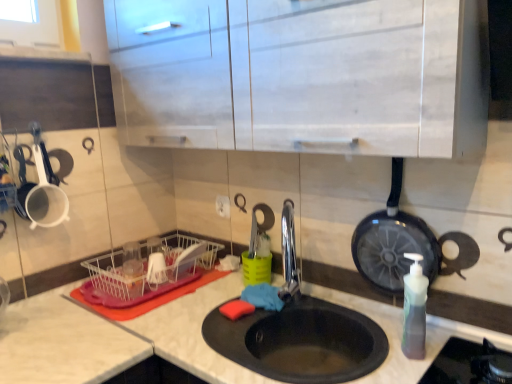
This screenshot has width=512, height=384. What do you see at coordinates (298, 332) in the screenshot? I see `black matte sink at center` at bounding box center [298, 332].

The height and width of the screenshot is (384, 512). Describe the element at coordinates (303, 75) in the screenshot. I see `white matte cabinet at upper center` at that location.

Where is `white matte cabinet at upper center`? The width and height of the screenshot is (512, 384). white matte cabinet at upper center is located at coordinates (303, 75).

I want to click on translucent plastic soap dispenser at right, so click(x=414, y=309).

What is the approximate height of clear plastic dish rack at lower left?

clear plastic dish rack at lower left is 5.10 inches tall.

Image resolution: width=512 pixels, height=384 pixels. I want to click on black matte sink at center, so click(298, 332).

Considering the positions of point (296, 268) and point (356, 260), is point (296, 268) closer or farther from the camera than point (356, 260)?

Point (296, 268) is farther from the camera than point (356, 260).

Do you think polished chrome faucet at center is within black non-stick frying pan at right, or outside of it?

polished chrome faucet at center exists outside the volume of black non-stick frying pan at right.

Is polished chrome faucet at center not near black non-stick frying pan at right?

That's not correct — polished chrome faucet at center is a little close to black non-stick frying pan at right.

Considering the sizes of objects polished chrome faucet at center and black non-stick frying pan at right in the image provided, who is bigger, polished chrome faucet at center or black non-stick frying pan at right?

black non-stick frying pan at right.

Is translucent plastic soap dispenser at right with clear plastic dish rack at lower left?

No, translucent plastic soap dispenser at right is not touching clear plastic dish rack at lower left.

Who is shorter, translucent plastic soap dispenser at right or clear plastic dish rack at lower left?

clear plastic dish rack at lower left.

At what (x,y) coordinates should I click in order to perform the action: click on basket above the translucent plastic soap dispenser at right (from the image's perspective). Please return your answer as a coordinate pair (x, y). Looking at the image, I should click on (145, 274).

Which is in front, point (423, 310) or point (188, 275)?

The point (423, 310) is in front.

Which point is more distant from viewer, (296, 282) or (148, 283)?

Point (148, 283)

From the image's perspective, which one is positioned higher, polished chrome faucet at center or clear plastic dish rack at lower left?

polished chrome faucet at center appears higher in the image.

Looking at their sizes, would you say polished chrome faucet at center is wider or thinner than clear plastic dish rack at lower left?

Considering their sizes, polished chrome faucet at center looks slimmer than clear plastic dish rack at lower left.

Can you confirm if polished chrome faucet at center is smaller than clear plastic dish rack at lower left?

Indeed, polished chrome faucet at center has a smaller size compared to clear plastic dish rack at lower left.

Find the location of a particular element. The width and height of the screenshot is (512, 384). basket located underneath the black non-stick frying pan at right (from a real-world perspective) is located at coordinates (145, 274).

Is clear plastic dish rack at lower left aimed at black non-stick frying pan at right?

No, clear plastic dish rack at lower left is not turned towards black non-stick frying pan at right.

From the image's perspective, is clear plastic dish rack at lower left over black non-stick frying pan at right?

Actually, clear plastic dish rack at lower left appears below black non-stick frying pan at right in the image.

Considering their positions, is clear plastic dish rack at lower left located in front of or behind black non-stick frying pan at right?

clear plastic dish rack at lower left is positioned farther from the viewer than black non-stick frying pan at right.

Choose the correct answer: Is white matte cabinet at upper center inside polished chrome faucet at center or outside it?

white matte cabinet at upper center cannot be found inside polished chrome faucet at center.

Does white matte cabinet at upper center have a lesser width compared to polished chrome faucet at center?

In fact, white matte cabinet at upper center might be wider than polished chrome faucet at center.

Is white matte cabinet at upper center bigger than polished chrome faucet at center?

Yes, white matte cabinet at upper center is bigger than polished chrome faucet at center.

Is white matte cabinet at upper center shorter than polished chrome faucet at center?

No.

In order to click on basket to the left of black matte sink at center in this screenshot , I will do `click(145, 274)`.

Between clear plastic dish rack at lower left and black matte sink at center, which one appears on the left side from the viewer's perspective?

From the viewer's perspective, clear plastic dish rack at lower left appears more on the left side.

From the image's perspective, between clear plastic dish rack at lower left and black matte sink at center, which one is located above?

clear plastic dish rack at lower left appears higher in the image.

Considering the positions of point (294, 237) and point (370, 154), is point (294, 237) closer or farther from the camera than point (370, 154)?

Point (294, 237) is positioned farther from the camera compared to point (370, 154).

Considering the relative sizes of polished chrome faucet at center and white matte cabinet at upper center in the image provided, is polished chrome faucet at center taller than white matte cabinet at upper center?

No, polished chrome faucet at center is not taller than white matte cabinet at upper center.

From a real-world perspective, is polished chrome faucet at center located higher than white matte cabinet at upper center?

No, from a real-world perspective, polished chrome faucet at center is not on top of white matte cabinet at upper center.

From the image's perspective, is polished chrome faucet at center located beneath white matte cabinet at upper center?

Yes, from the image's perspective, polished chrome faucet at center is beneath white matte cabinet at upper center.

Locate an element on the screen. The image size is (512, 384). frying pan in front of the polished chrome faucet at center is located at coordinates (393, 242).

You are a GUI agent. You are given a task and a screenshot of the screen. Output one action in this format:
    pyautogui.click(x=<x>, y=<y>)
    Task: Click on the basket located behind the translucent plastic soap dispenser at right
    The height and width of the screenshot is (384, 512).
    Given the screenshot: What is the action you would take?
    pyautogui.click(x=145, y=274)

Considering their positions, is translucent plastic soap dispenser at right positioned further to black matte sink at center than white matte cabinet at upper center?

white matte cabinet at upper center.

From the image, which object appears to be nearer to translucent plastic soap dispenser at right, polished chrome faucet at center or black matte sink at center?

black matte sink at center lies closer to translucent plastic soap dispenser at right than the other object.

Looking at the image, which one is located further to polished chrome faucet at center, black matte sink at center or clear plastic dish rack at lower left?

Based on the image, clear plastic dish rack at lower left appears to be further to polished chrome faucet at center.

Looking at the image, which one is located closer to translucent plastic soap dispenser at right, black non-stick frying pan at right or polished chrome faucet at center?

Among the two, black non-stick frying pan at right is located nearer to translucent plastic soap dispenser at right.

Based on their spatial positions, is translucent plastic soap dispenser at right or clear plastic dish rack at lower left closer to black matte sink at center?

translucent plastic soap dispenser at right is closer to black matte sink at center.

Looking at the image, which one is located closer to polished chrome faucet at center, translucent plastic soap dispenser at right or white matte cabinet at upper center?

translucent plastic soap dispenser at right is closer to polished chrome faucet at center.

When comparing their distances from polished chrome faucet at center, does clear plastic dish rack at lower left or black matte sink at center seem further?

Among the two, clear plastic dish rack at lower left is located further to polished chrome faucet at center.

From the image, which object appears to be nearer to black matte sink at center, white matte cabinet at upper center or black non-stick frying pan at right?

Based on the image, black non-stick frying pan at right appears to be nearer to black matte sink at center.

I want to click on soap dispenser between white matte cabinet at upper center and black matte sink at center in the vertical direction, so click(x=414, y=309).

The image size is (512, 384). Find the location of `sink between clear plastic dish rack at lower left and polished chrome faucet at center`. sink between clear plastic dish rack at lower left and polished chrome faucet at center is located at coordinates (298, 332).

The image size is (512, 384). I want to click on frying pan between white matte cabinet at upper center and black matte sink at center vertically, so click(393, 242).

I want to click on faucet between white matte cabinet at upper center and black matte sink at center in the up-down direction, so click(x=289, y=254).